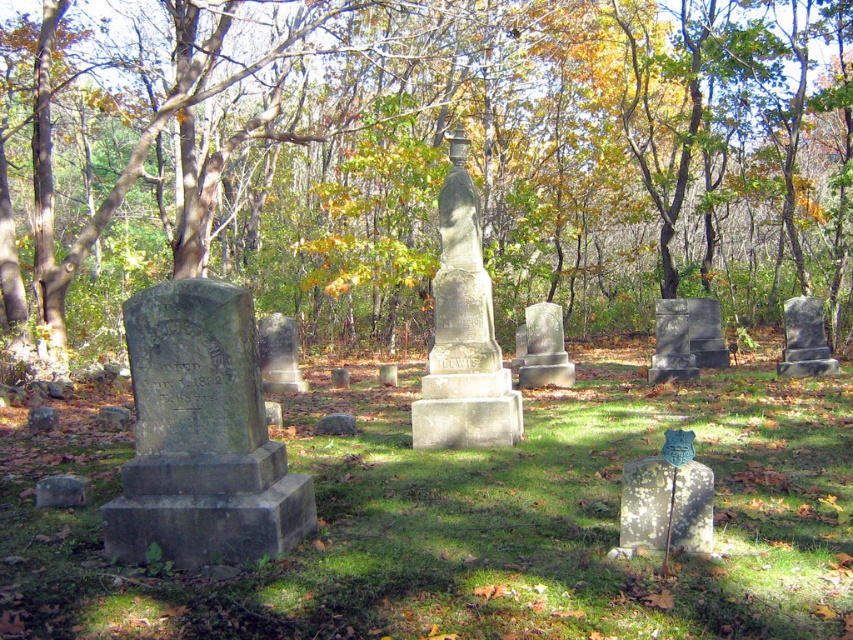
You are standing at the entrance of the cemetery and want to reach the point marked by point (701, 499). Which direction should you walk relative to point (671, 349)?

You should walk towards point (701, 499), which is in front of point (671, 349).

You are a gardener tasked with mowing the lawn in the cemetery. You notice the green grass at center and the dark gray stone gravestone at right. Which area should you avoid mowing to prevent damaging the gravestone?

You should avoid mowing near the dark gray stone gravestone at right because the green grass at center is positioned on its left side, meaning the gravestone is to the right of the grass. Mowing too close to the gravestone could risk damaging it, so maintain a safe distance around it.

You are a groundskeeper tasked with mowing the grass between the speckled stone gravestone at lower right and the dark gray stone gravestone at right. Which gravestone should you avoid hitting with the mower since it is closer to the mowing path?

The speckled stone gravestone at lower right should be avoided because it is closer to the mowing path compared to the dark gray stone gravestone at right.